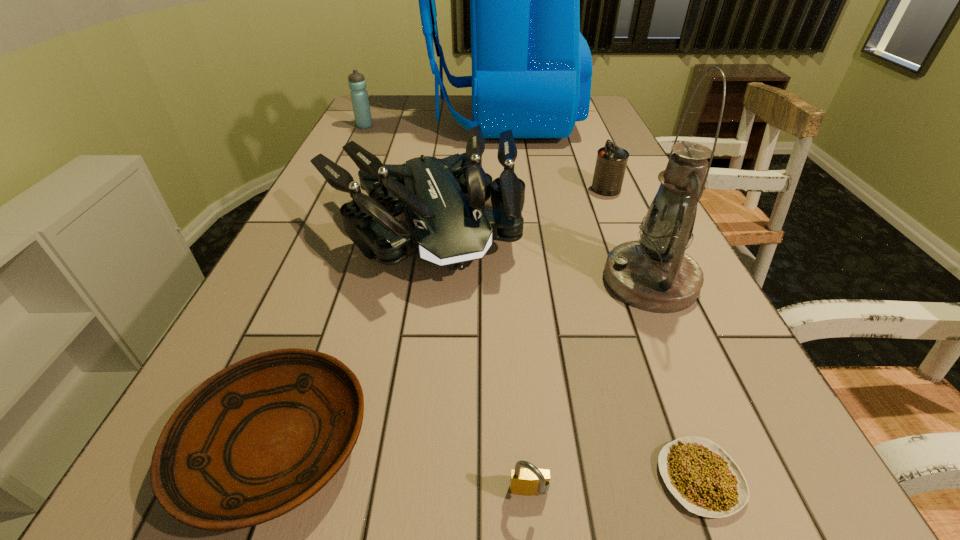
The image size is (960, 540). I want to click on free space between the fifth tallest object and the backpack, so click(554, 155).

The width and height of the screenshot is (960, 540). I want to click on unoccupied area between the drone and the sixth tallest object, so click(475, 362).

Identify the location of free space between the fifth tallest object and the seventh shortest object. The image size is (960, 540). (628, 235).

At what (x,y) coordinates should I click in order to perform the action: click on free space between the fourth shortest object and the second tallest object. Please return your answer as a coordinate pair (x, y). This screenshot has width=960, height=540. Looking at the image, I should click on (628, 235).

The height and width of the screenshot is (540, 960). What are the coordinates of `empty location between the water bottle and the legume` in the screenshot? It's located at (532, 302).

Find the location of a particular element. The image size is (960, 540). free space between the seventh shortest object and the padlock is located at coordinates (589, 388).

At what (x,y) coordinates should I click in order to perform the action: click on unoccupied area between the tallest object and the can. Please return your answer as a coordinate pair (x, y). Looking at the image, I should click on (554, 155).

Image resolution: width=960 pixels, height=540 pixels. What are the coordinates of `object that is the fourth closest one to the water bottle` in the screenshot? It's located at (654, 274).

Identify which object is the third closest to the shortest object. Please provide its 2D coordinates. Your answer should be formatted as a tuple, i.e. [(x, y)], where the tuple contains the x and y coordinates of a point satisfying the conditions above.

[(446, 223)]

You are a GUI agent. You are given a task and a screenshot of the screen. Output one action in this format:
    pyautogui.click(x=<x>, y=<y>)
    Task: Click on the free spot that satisfies the following two spatial constraints: 1. on the back side of the fourth shortest object; 2. on the back of the backpack
    
    Given the screenshot: What is the action you would take?
    pyautogui.click(x=577, y=121)